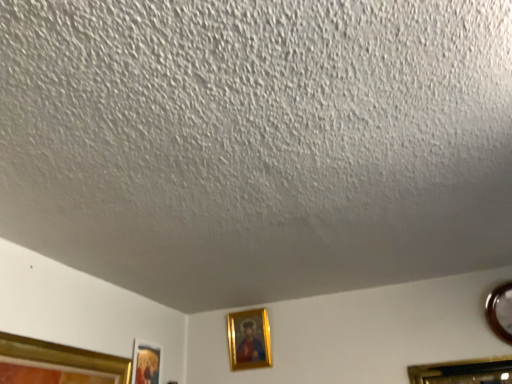
Question: Is gold-framed picture at center, the second picture frame positioned from the left, not inside gold-framed picture at lower left, the 1th picture frame positioned from the left?

Choices:
 (A) yes
 (B) no

Answer: (A)

Question: Is gold-framed picture at center, the second picture frame positioned from the left, behind gold-framed picture at lower left, the 1th picture frame positioned from the left?

Choices:
 (A) no
 (B) yes

Answer: (B)

Question: Is gold-framed picture at center, acting as the 2th picture frame starting from the right, at the left side of gold-framed picture at lower left, the 1th picture frame positioned from the left?

Choices:
 (A) no
 (B) yes

Answer: (A)

Question: Does gold-framed picture at center, the second picture frame positioned from the left, have a lesser width compared to gold-framed picture at lower left, the 1th picture frame positioned from the left?

Choices:
 (A) no
 (B) yes

Answer: (A)

Question: Is gold-framed picture at center, the second picture frame positioned from the left, positioned before gold-framed picture at lower left, positioned as the third picture frame in right-to-left order?

Choices:
 (A) no
 (B) yes

Answer: (A)

Question: Is gold-framed picture at lower left, positioned as the third picture frame in right-to-left order, a part of gold-framed picture at center, acting as the 2th picture frame starting from the right?

Choices:
 (A) no
 (B) yes

Answer: (A)

Question: Considering the relative sizes of gold-framed picture at lower left, positioned as the third picture frame in right-to-left order, and metallic circular frame at right, which is counted as the 1th picture frame, starting from the right, in the image provided, is gold-framed picture at lower left, positioned as the third picture frame in right-to-left order, shorter than metallic circular frame at right, which is counted as the 1th picture frame, starting from the right,?

Choices:
 (A) no
 (B) yes

Answer: (A)

Question: Is gold-framed picture at lower left, positioned as the third picture frame in right-to-left order, in front of metallic circular frame at right, which is counted as the 1th picture frame, starting from the right?

Choices:
 (A) yes
 (B) no

Answer: (B)

Question: From the image's perspective, is gold-framed picture at lower left, the 1th picture frame positioned from the left, below metallic circular frame at right, the third picture frame in the left-to-right sequence?

Choices:
 (A) no
 (B) yes

Answer: (B)

Question: Does gold-framed picture at lower left, positioned as the third picture frame in right-to-left order, touch metallic circular frame at right, which is counted as the 1th picture frame, starting from the right?

Choices:
 (A) no
 (B) yes

Answer: (A)

Question: Does gold-framed picture at lower left, positioned as the third picture frame in right-to-left order, have a larger size compared to metallic circular frame at right, the third picture frame in the left-to-right sequence?

Choices:
 (A) yes
 (B) no

Answer: (B)

Question: From a real-world perspective, is gold-framed picture at lower left, positioned as the third picture frame in right-to-left order, beneath metallic circular frame at right, which is counted as the 1th picture frame, starting from the right?

Choices:
 (A) yes
 (B) no

Answer: (A)

Question: Does metallic circular frame at right, which is counted as the 1th picture frame, starting from the right, lie behind gold-framed picture at center, acting as the 2th picture frame starting from the right?

Choices:
 (A) yes
 (B) no

Answer: (B)